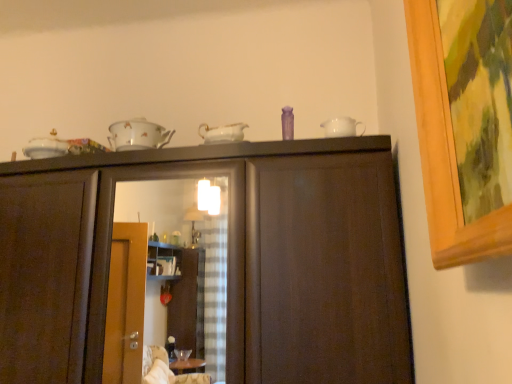
What do you see at coordinates (205, 265) in the screenshot? The width and height of the screenshot is (512, 384). I see `dark wood cabinet at upper center` at bounding box center [205, 265].

Where is `dark wood cabinet at upper center`? The image size is (512, 384). dark wood cabinet at upper center is located at coordinates (205, 265).

In order to click on dark wood cabinet at upper center in this screenshot , I will do `click(205, 265)`.